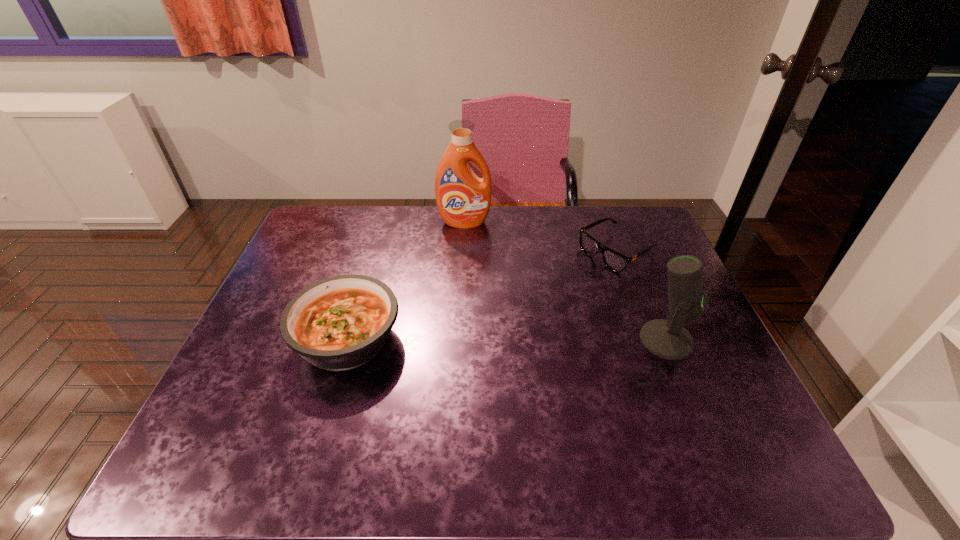
At what (x,y) coordinates should I click in order to perform the action: click on the third tallest object. Please return your answer as a coordinate pair (x, y). Image resolution: width=960 pixels, height=540 pixels. Looking at the image, I should click on (339, 323).

Find the location of `the leftmost object`. the leftmost object is located at coordinates (339, 323).

Identify the location of the third shortest object. (668, 339).

Where is `the shortest object`? This screenshot has height=540, width=960. the shortest object is located at coordinates (613, 260).

Locate an element on the screen. This screenshot has width=960, height=540. the third nearest object is located at coordinates (613, 260).

Locate an element on the screen. Image resolution: width=960 pixels, height=540 pixels. detergent is located at coordinates (463, 199).

Where is `the tallest object`? the tallest object is located at coordinates (463, 199).

Where is `free spot located on the back of the stew`? free spot located on the back of the stew is located at coordinates (370, 264).

This screenshot has height=540, width=960. In order to click on vacant space located on the front of the third shortest object in this screenshot , I will do `click(683, 379)`.

The image size is (960, 540). I want to click on vacant space located on the front-facing side of the sunglasses, so click(545, 293).